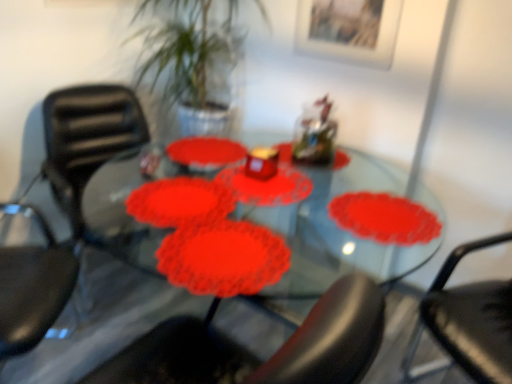
Question: Is black plastic chair at right, the second chair when ordered from left to right, further to the viewer compared to matte black chair at left, the second chair in the right-to-left sequence?

Choices:
 (A) yes
 (B) no

Answer: (B)

Question: Does black plastic chair at right, acting as the 1th chair starting from the right, lie in front of matte black chair at left, which ranks as the first chair in left-to-right order?

Choices:
 (A) no
 (B) yes

Answer: (B)

Question: Is black plastic chair at right, the second chair when ordered from left to right, at the left side of matte black chair at left, which ranks as the first chair in left-to-right order?

Choices:
 (A) no
 (B) yes

Answer: (A)

Question: From a real-world perspective, is black plastic chair at right, acting as the 1th chair starting from the right, beneath matte black chair at left, the second chair in the right-to-left sequence?

Choices:
 (A) no
 (B) yes

Answer: (B)

Question: Considering the relative positions of black plastic chair at right, acting as the 1th chair starting from the right, and matte black chair at left, which ranks as the first chair in left-to-right order, in the image provided, is black plastic chair at right, acting as the 1th chair starting from the right, to the right of matte black chair at left, which ranks as the first chair in left-to-right order, from the viewer's perspective?

Choices:
 (A) no
 (B) yes

Answer: (B)

Question: From the image's perspective, is black plastic chair at right, acting as the 1th chair starting from the right, beneath matte black chair at left, which ranks as the first chair in left-to-right order?

Choices:
 (A) yes
 (B) no

Answer: (A)

Question: Does matte black chair at left, the second chair in the right-to-left sequence, have a lesser width compared to black plastic chair at right, the second chair when ordered from left to right?

Choices:
 (A) yes
 (B) no

Answer: (A)

Question: Considering the relative positions of matte black chair at left, which ranks as the first chair in left-to-right order, and black plastic chair at right, the second chair when ordered from left to right, in the image provided, is matte black chair at left, which ranks as the first chair in left-to-right order, to the right of black plastic chair at right, the second chair when ordered from left to right, from the viewer's perspective?

Choices:
 (A) no
 (B) yes

Answer: (A)

Question: Considering the relative positions of matte black chair at left, the second chair in the right-to-left sequence, and black plastic chair at right, the second chair when ordered from left to right, in the image provided, is matte black chair at left, the second chair in the right-to-left sequence, in front of black plastic chair at right, the second chair when ordered from left to right,?

Choices:
 (A) no
 (B) yes

Answer: (A)

Question: Can you confirm if matte black chair at left, which ranks as the first chair in left-to-right order, is wider than black plastic chair at right, acting as the 1th chair starting from the right?

Choices:
 (A) yes
 (B) no

Answer: (B)

Question: Is matte black chair at left, which ranks as the first chair in left-to-right order, oriented away from black plastic chair at right, acting as the 1th chair starting from the right?

Choices:
 (A) no
 (B) yes

Answer: (A)

Question: From the image's perspective, is matte black chair at left, which ranks as the first chair in left-to-right order, beneath black plastic chair at right, the second chair when ordered from left to right?

Choices:
 (A) no
 (B) yes

Answer: (A)

Question: From a real-world perspective, is matte black chair at left, the second chair in the right-to-left sequence, positioned above or below black plastic chair at right, the second chair when ordered from left to right?

Choices:
 (A) below
 (B) above

Answer: (B)